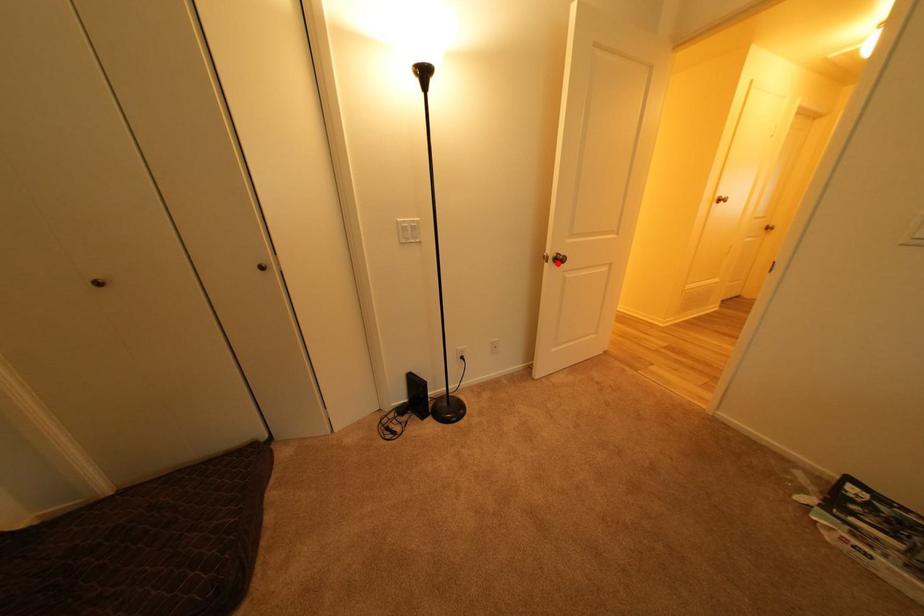
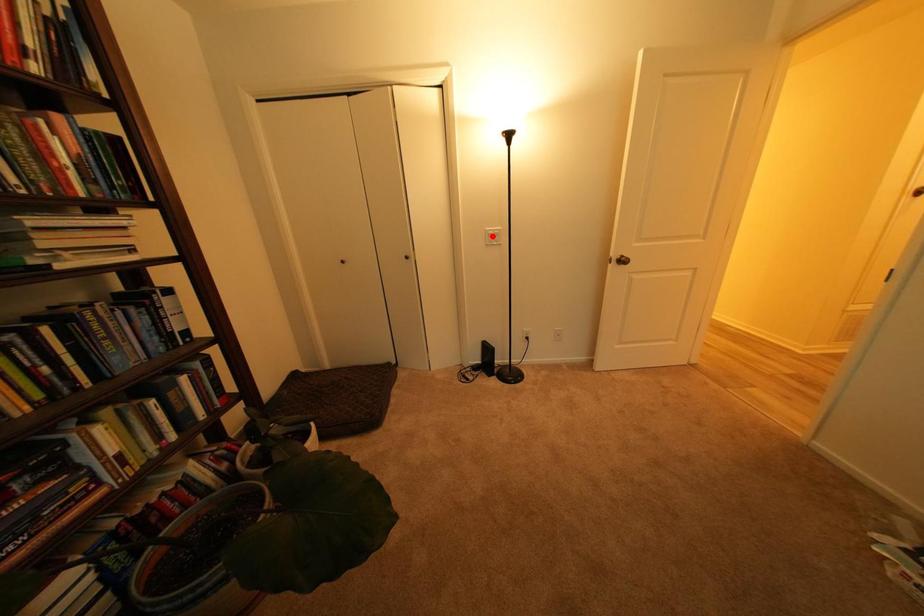
I am providing you with two images of the same scene from different viewpoints. A red point is marked on the first image and another point is marked on the second image. Does the point marked in image1 correspond to the same location as the one in image2?

No